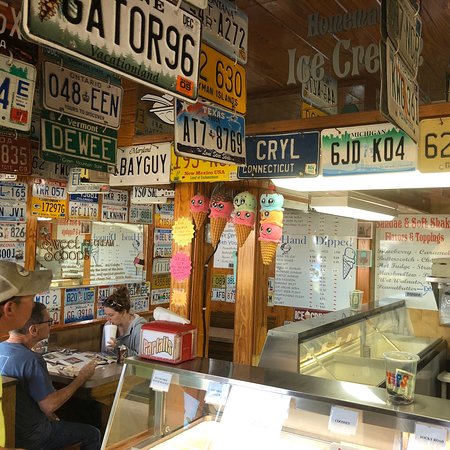
This screenshot has height=450, width=450. In order to click on tip jars in this screenshot , I will do `click(358, 299)`, `click(404, 378)`.